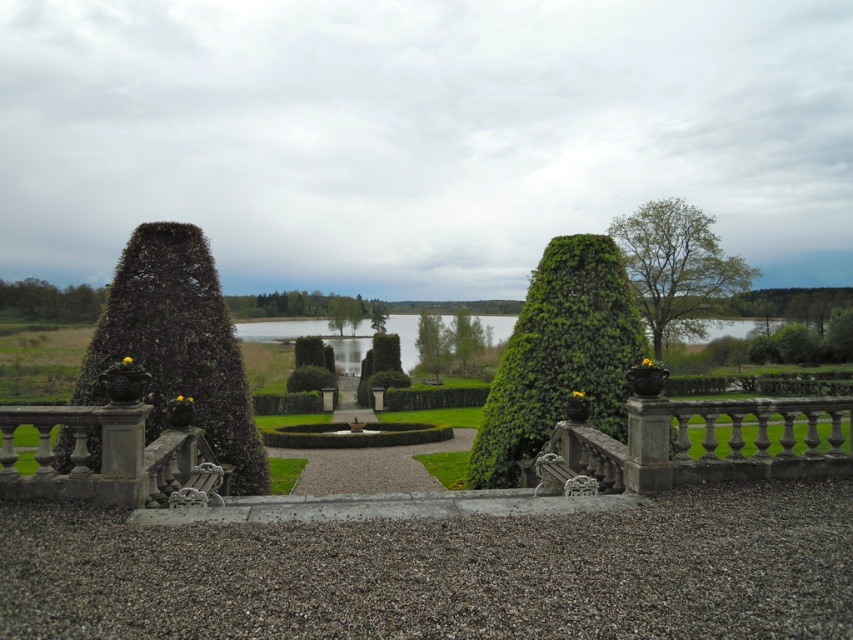
Consider the image. Which is above, green leafy bush at left or stone balustrade at lower left?

green leafy bush at left is higher up.

Is point (155, 269) positioned before point (148, 504)?

No, (155, 269) is behind (148, 504).

I want to click on green leafy bush at left, so click(x=177, y=344).

Does gray gravel at lower center appear on the left side of green leafy tree at upper left?

In fact, gray gravel at lower center is to the right of green leafy tree at upper left.

Is gray gravel at lower center wider than green leafy tree at upper left?

No, gray gravel at lower center is not wider than green leafy tree at upper left.

Where is `gray gravel at lower center`? The width and height of the screenshot is (853, 640). gray gravel at lower center is located at coordinates (444, 572).

Locate an element on the screen. gray gravel at lower center is located at coordinates (444, 572).

Based on the photo, how much distance is there between green leafy bush at left and green leafy bush at center?

A distance of 4.52 meters exists between green leafy bush at left and green leafy bush at center.

Between green leafy bush at left and green leafy bush at center, which one appears on the right side from the viewer's perspective?

green leafy bush at center

Does point (242, 413) come behind point (582, 326)?

That is True.

This screenshot has height=640, width=853. Identify the location of green leafy bush at left. (177, 344).